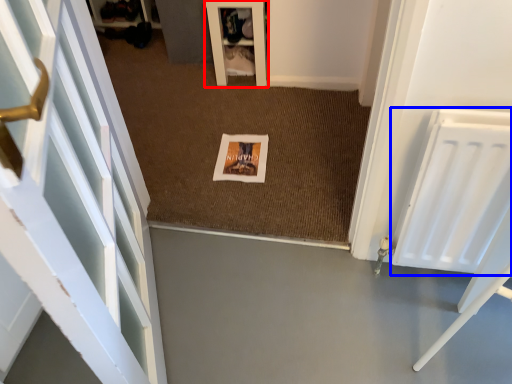
Question: Which object is closer to the camera taking this photo, furniture (highlighted by a red box) or radiator (highlighted by a blue box)?

Choices:
 (A) furniture
 (B) radiator

Answer: (B)